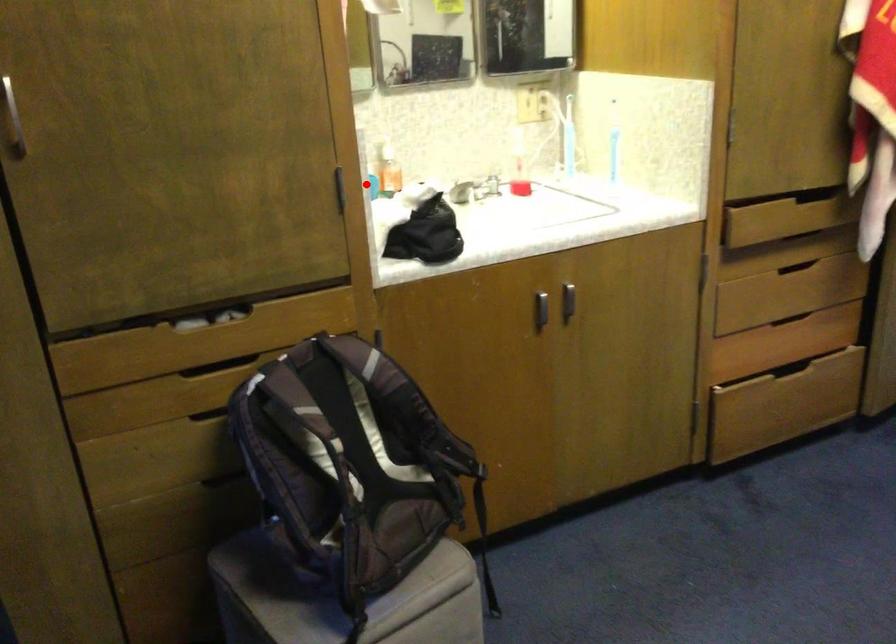
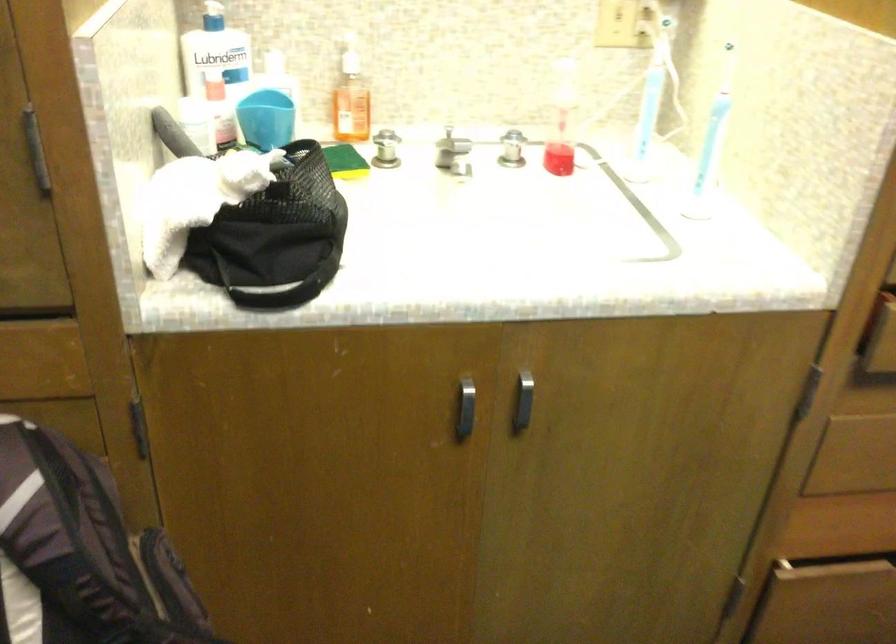
Find the pixel in the second image that matches the highlighted location in the first image.

(265, 118)